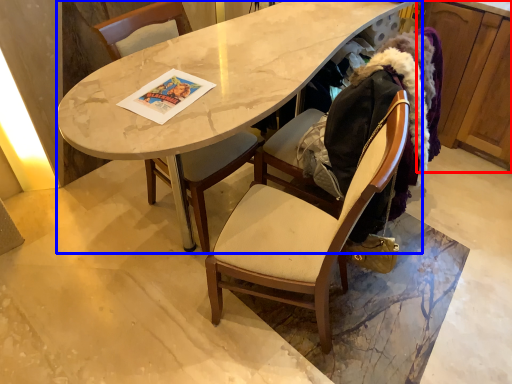
Question: Among these objects, which one is nearest to the camera, cabinetry (highlighted by a red box) or desk (highlighted by a blue box)?

Choices:
 (A) cabinetry
 (B) desk

Answer: (B)